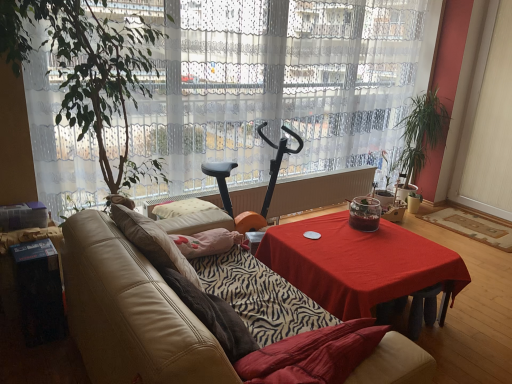
Question: From a real-world perspective, is green leafy plant at left, arranged as the 1th houseplant when viewed from the front, located higher than transparent glass jar at center?

Choices:
 (A) yes
 (B) no

Answer: (A)

Question: Is the depth of green leafy plant at left, arranged as the first houseplant when viewed from the left, greater than that of transparent glass jar at center?

Choices:
 (A) yes
 (B) no

Answer: (B)

Question: Is transparent glass jar at center a part of green leafy plant at left, placed as the 2th houseplant when sorted from back to front?

Choices:
 (A) yes
 (B) no

Answer: (B)

Question: Is green leafy plant at left, placed as the 2th houseplant when sorted from back to front, far from transparent glass jar at center?

Choices:
 (A) no
 (B) yes

Answer: (B)

Question: Can you confirm if green leafy plant at left, placed as the 2th houseplant when sorted from back to front, is shorter than transparent glass jar at center?

Choices:
 (A) yes
 (B) no

Answer: (B)

Question: Is leather couch at center in front of or behind transparent glass jar at center in the image?

Choices:
 (A) behind
 (B) front

Answer: (B)

Question: Would you say leather couch at center is to the left or to the right of transparent glass jar at center in the picture?

Choices:
 (A) right
 (B) left

Answer: (B)

Question: Looking at their shapes, would you say leather couch at center is wider or thinner than transparent glass jar at center?

Choices:
 (A) wide
 (B) thin

Answer: (A)

Question: Is leather couch at center inside the boundaries of transparent glass jar at center, or outside?

Choices:
 (A) outside
 (B) inside

Answer: (A)

Question: Is green leafy plant at left, arranged as the first houseplant when viewed from the left, bigger or smaller than white sheer curtain at center?

Choices:
 (A) big
 (B) small

Answer: (B)

Question: Considering the positions of point (145, 52) and point (205, 107), is point (145, 52) closer or farther from the camera than point (205, 107)?

Choices:
 (A) farther
 (B) closer

Answer: (B)

Question: Is green leafy plant at left, placed as the 2th houseplant when sorted from back to front, inside the boundaries of white sheer curtain at center, or outside?

Choices:
 (A) outside
 (B) inside

Answer: (A)

Question: Is green leafy plant at left, placed as the 2th houseplant when sorted from back to front, wider or thinner than white sheer curtain at center?

Choices:
 (A) thin
 (B) wide

Answer: (B)

Question: Is green leafy plant at left, arranged as the 1th houseplant when viewed from the front, in front of or behind red cloth-covered table at center in the image?

Choices:
 (A) behind
 (B) front

Answer: (B)

Question: Is green leafy plant at left, arranged as the 1th houseplant when viewed from the front, to the left or to the right of red cloth-covered table at center in the image?

Choices:
 (A) right
 (B) left

Answer: (B)